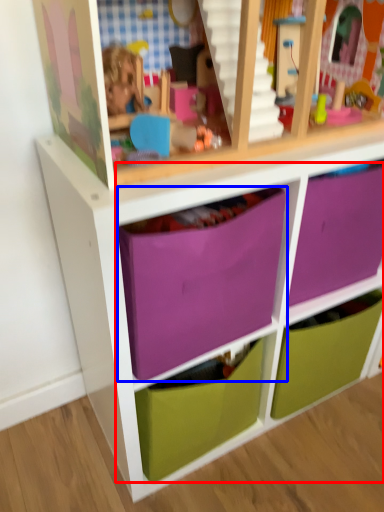
Question: Among these objects, which one is nearest to the camera, drawer (highlighted by a red box) or drawer (highlighted by a blue box)?

Choices:
 (A) drawer
 (B) drawer

Answer: (A)